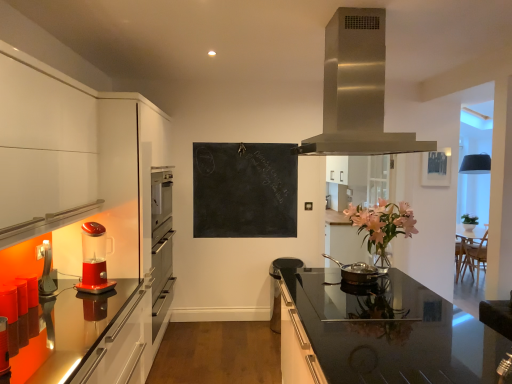
The width and height of the screenshot is (512, 384). Find the location of `free space in front of bronze metallic pan at center, which appears as the 2th kitchen appliance when viewed from the left`. free space in front of bronze metallic pan at center, which appears as the 2th kitchen appliance when viewed from the left is located at coordinates (351, 293).